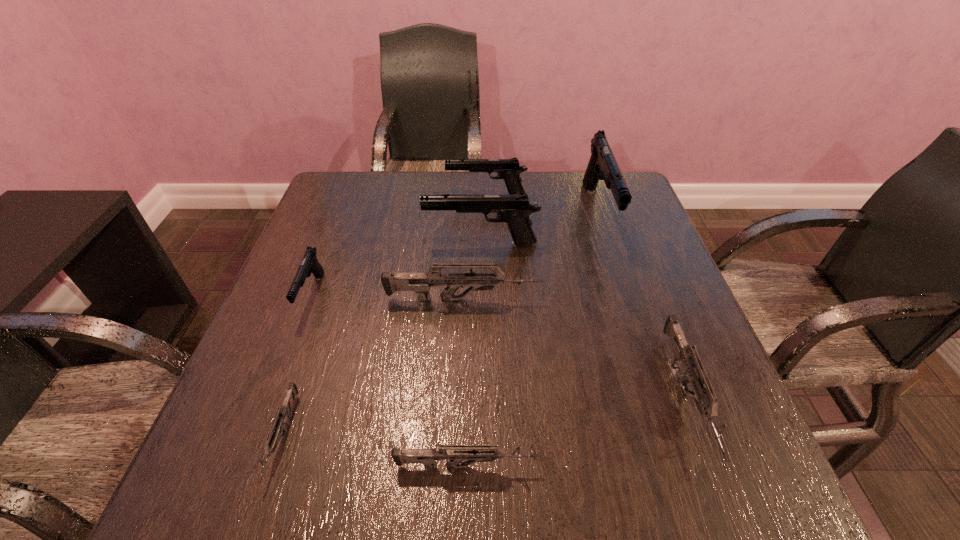
Locate an element on the screen. Image resolution: width=960 pixels, height=540 pixels. free region at the right edge of the desktop is located at coordinates (638, 320).

Locate an element on the screen. vacant space at the far left corner is located at coordinates click(384, 188).

Where is `free spot at the near left corner of the desktop`? This screenshot has width=960, height=540. free spot at the near left corner of the desktop is located at coordinates (271, 487).

Where is `free region at the far right corner of the desktop`? The height and width of the screenshot is (540, 960). free region at the far right corner of the desktop is located at coordinates (596, 212).

You are a GUI agent. You are given a task and a screenshot of the screen. Output one action in this format:
    pyautogui.click(x=<x>, y=<y>)
    Task: Click on the vacant space that's between the rightmost grey gun and the tallest object
    This screenshot has width=960, height=540.
    Given the screenshot: What is the action you would take?
    pyautogui.click(x=642, y=304)

Identify the location of vacant space in between the leftmost gun and the second shortest object. tap(389, 380).

The image size is (960, 540). I want to click on vacant area between the second tallest gun and the seventh gun from right to left, so click(x=382, y=341).

This screenshot has width=960, height=540. I want to click on vacant area that lies between the rightmost gun and the second shortest gun, so click(x=576, y=431).

Find the location of `vacant area that lies between the seventh object from left to right and the second smallest black gun`. vacant area that lies between the seventh object from left to right and the second smallest black gun is located at coordinates (542, 204).

What are the coordinates of `free spot between the biggest black gun and the third biggest black gun` in the screenshot? It's located at (542, 204).